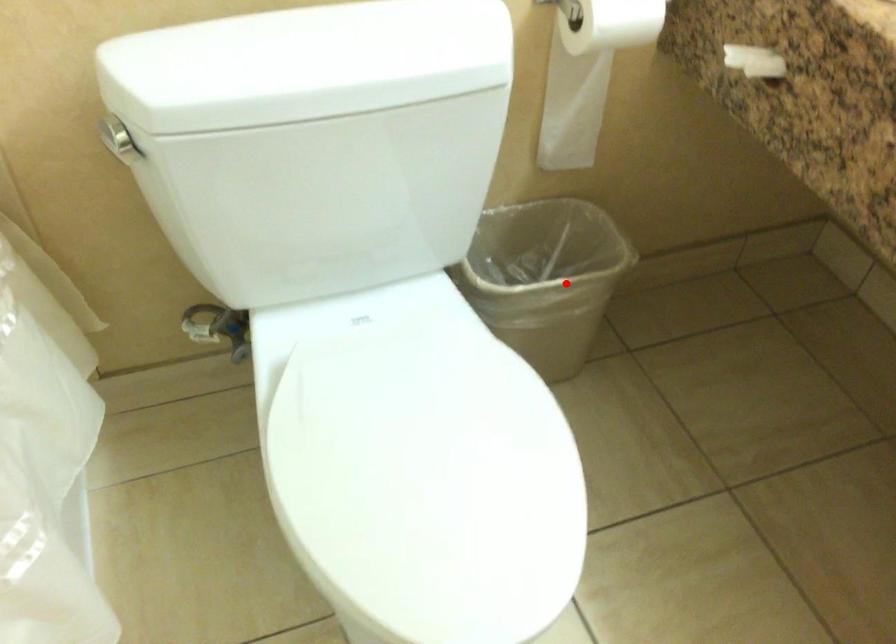
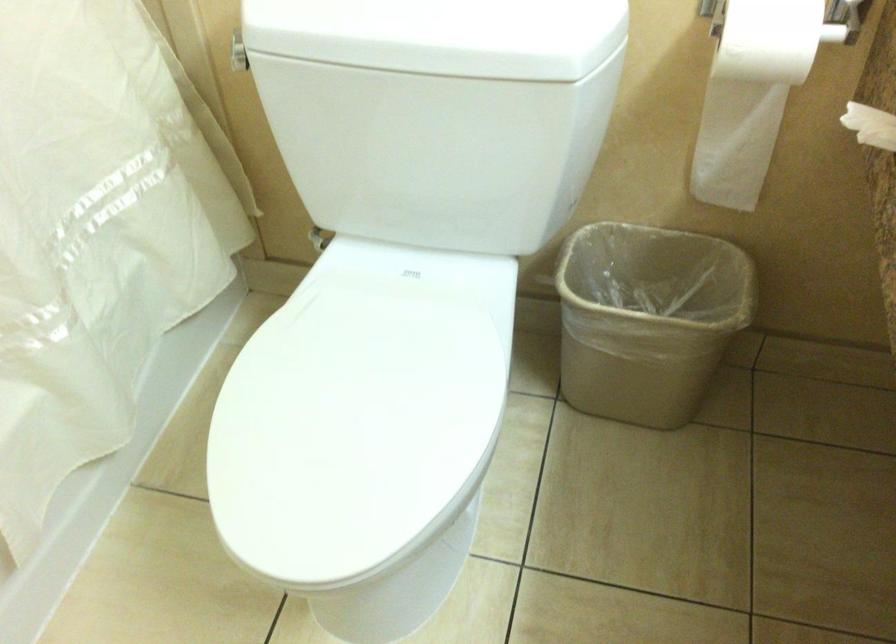
In the second image, find the point that corresponds to the highlighted location in the first image.

(647, 319)